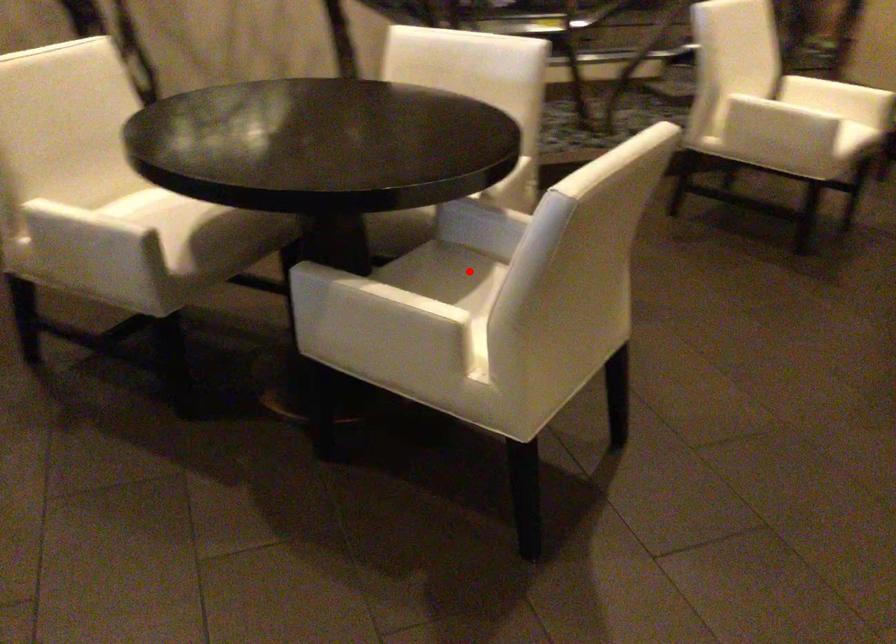
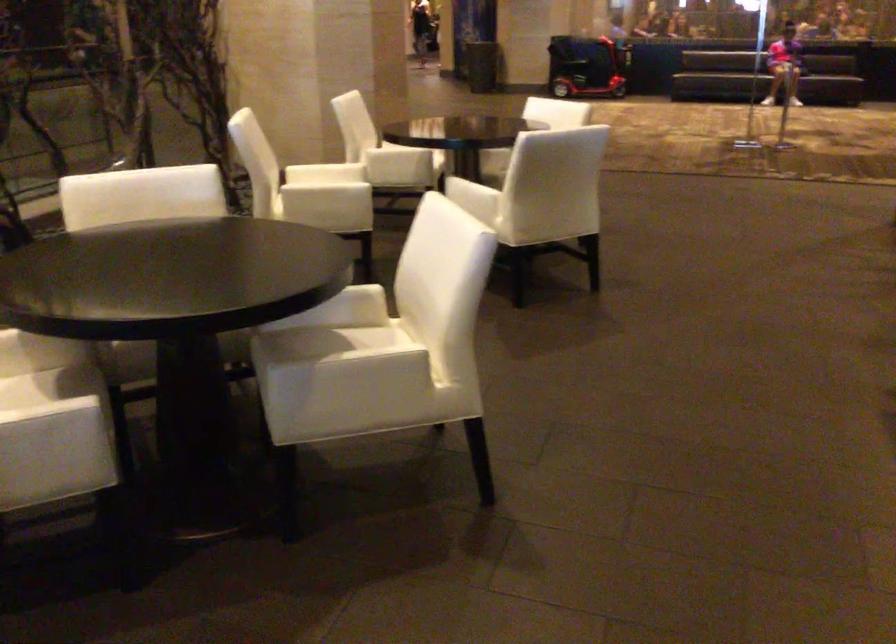
The point at the highlighted location is marked in the first image. Where is the corresponding point in the second image?

(324, 339)